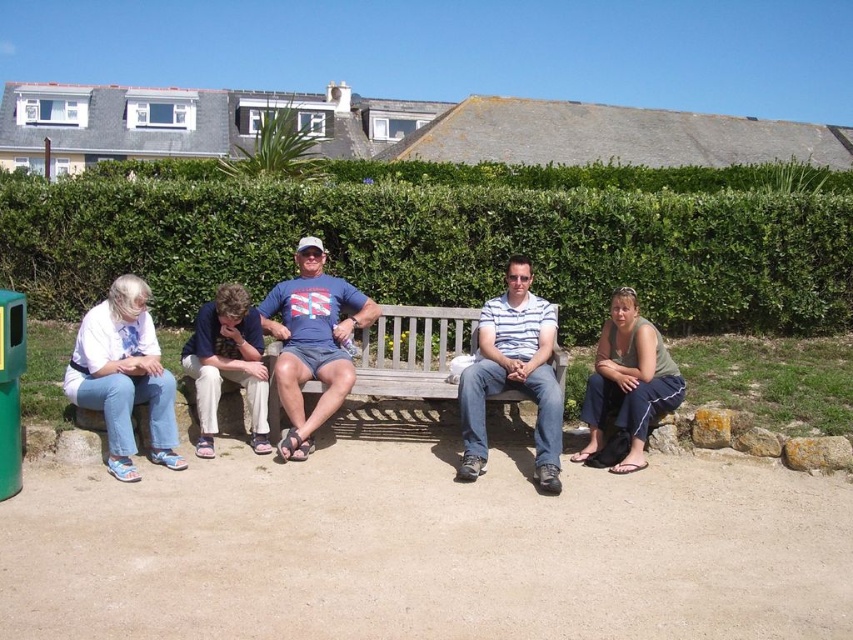
Between point (554, 228) and point (625, 385), which one is positioned in front?

Point (625, 385) is more forward.

Can you confirm if green leafy hedge at center is shorter than green fabric pants at center?

No, green leafy hedge at center is not shorter than green fabric pants at center.

Find the location of a particular element. The image size is (853, 640). green leafy hedge at center is located at coordinates (444, 244).

Identify the location of green leafy hedge at center. This screenshot has height=640, width=853. (444, 244).

Which is more to the right, matte blue jeans at center or striped cotton shirt at center?

striped cotton shirt at center is more to the right.

Can you confirm if matte blue jeans at center is shorter than striped cotton shirt at center?

Incorrect, matte blue jeans at center's height does not fall short of striped cotton shirt at center's.

Is point (361, 330) farther from camera compared to point (529, 321)?

Yes, point (361, 330) is behind point (529, 321).

Where is `matte blue jeans at center`? Image resolution: width=853 pixels, height=640 pixels. matte blue jeans at center is located at coordinates (393, 358).

Does matte blue jeans at center appear on the left side of blue cotton t-shirt at center?

No, matte blue jeans at center is not to the left of blue cotton t-shirt at center.

Image resolution: width=853 pixels, height=640 pixels. Find the location of `matte blue jeans at center`. matte blue jeans at center is located at coordinates (393, 358).

Locate an element on the screen. matte blue jeans at center is located at coordinates (393, 358).